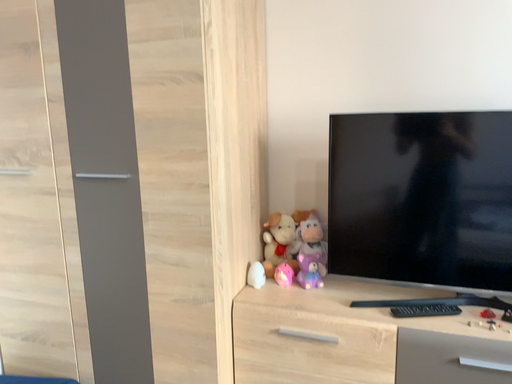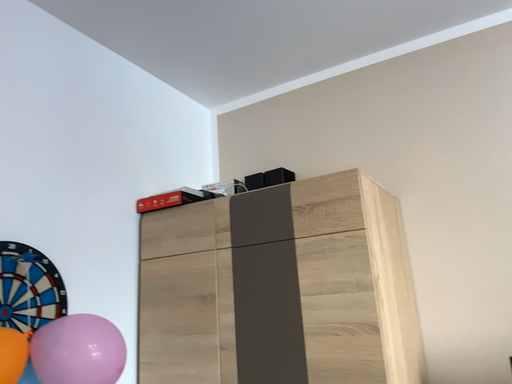
Question: Which way did the camera rotate in the video?

Choices:
 (A) rotated left
 (B) rotated right

Answer: (A)